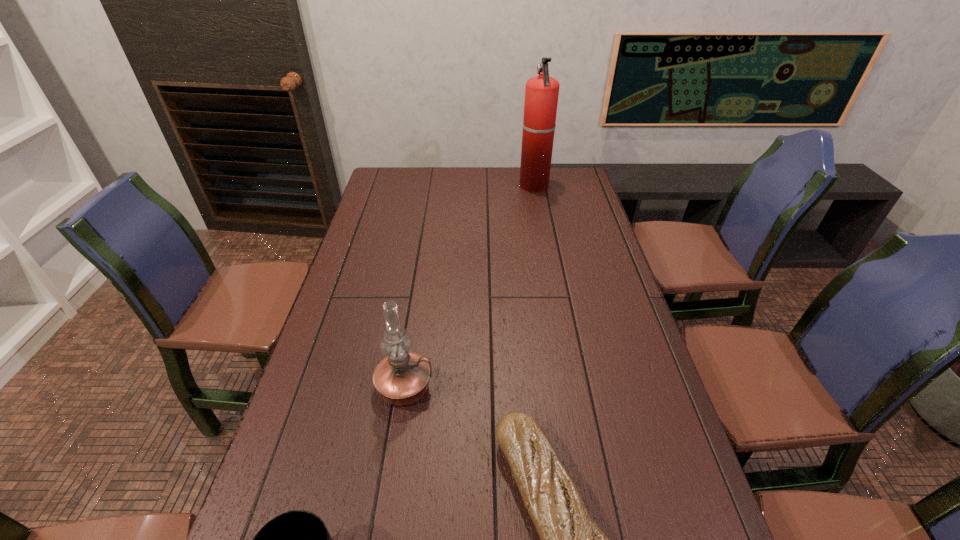
I want to click on the tallest object, so click(541, 92).

This screenshot has height=540, width=960. Find the location of `fire extinguisher`. fire extinguisher is located at coordinates (541, 92).

You are a GUI agent. You are given a task and a screenshot of the screen. Output one action in this format:
    pyautogui.click(x=<x>, y=<y>)
    Task: Click on the third shortest object
    This screenshot has width=960, height=540.
    Given the screenshot: What is the action you would take?
    pyautogui.click(x=402, y=378)

Where is `oil lamp`? This screenshot has height=540, width=960. oil lamp is located at coordinates (402, 378).

Identify the location of vacant space located with the nozzle and gauge on the farthest object. The width and height of the screenshot is (960, 540). (438, 186).

Where is `vacant space located with the nozzle and gauge on the farthest object`? Image resolution: width=960 pixels, height=540 pixels. vacant space located with the nozzle and gauge on the farthest object is located at coordinates click(492, 186).

Identify the location of vacant space situated 0.360m with the nozzle and gauge on the farthest object. (433, 186).

Locate an element on the screen. This screenshot has width=960, height=540. blank space located 0.220m on the back of the oil lamp is located at coordinates (418, 305).

The width and height of the screenshot is (960, 540). I want to click on object that is at the far edge, so click(541, 92).

The height and width of the screenshot is (540, 960). What are the coordinates of `object that is at the right edge` in the screenshot? It's located at (541, 92).